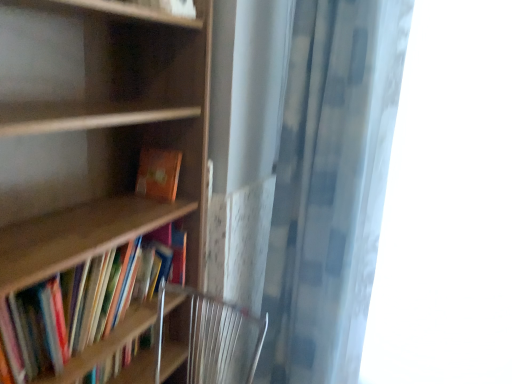
Question: Looking at their shapes, would you say wooden bookcase at left is wider or thinner than checkered fabric shower curtain at right?

Choices:
 (A) thin
 (B) wide

Answer: (B)

Question: From the image's perspective, is wooden bookcase at left located above or below checkered fabric shower curtain at right?

Choices:
 (A) below
 (B) above

Answer: (A)

Question: Which of these objects is positioned farthest from the wooden bookcase at left?

Choices:
 (A) transparent fabric at right
 (B) wooden bookshelf at left, which appears as the 1th book when ordered from the bottom
 (C) orange matte book at center, the first book positioned from the top
 (D) checkered fabric shower curtain at right

Answer: (A)

Question: Based on their relative distances, which object is nearer to the wooden bookshelf at left, which appears as the 2th book when viewed from the top?

Choices:
 (A) orange matte book at center, which is the 2th book in bottom-to-top order
 (B) wooden bookcase at left
 (C) transparent fabric at right
 (D) checkered fabric shower curtain at right

Answer: (B)